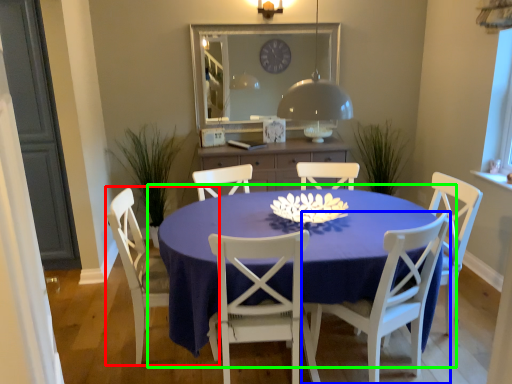
Question: Considering the real-world distances, which object is closest to chair (highlighted by a red box)? chair (highlighted by a blue box) or kitchen & dining room table (highlighted by a green box).

Choices:
 (A) chair
 (B) kitchen & dining room table

Answer: (B)